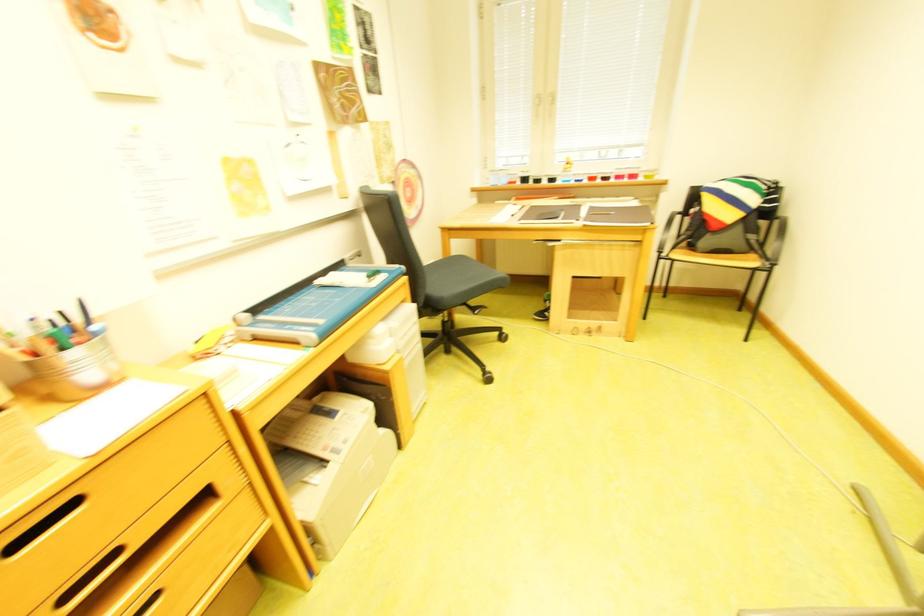
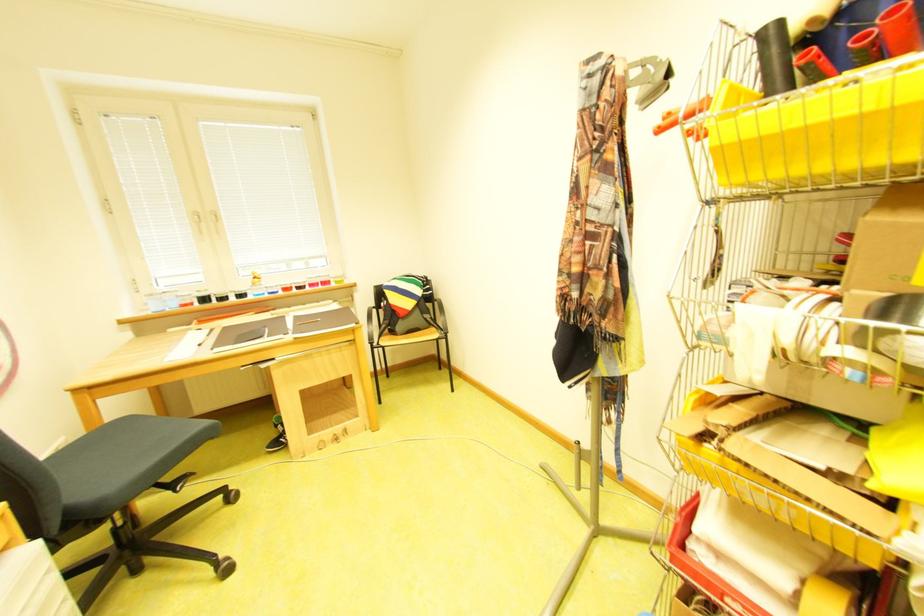
Find the pixel in the second image that matches [758,249] in the first image.

(439, 326)